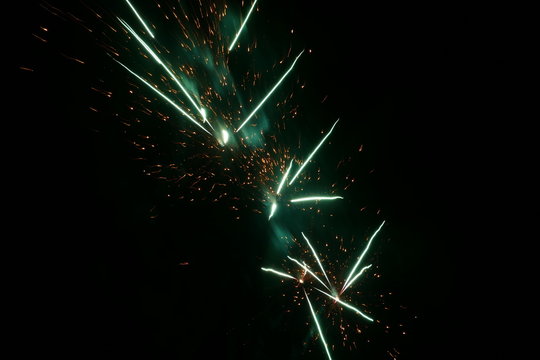
In order to click on light in this screenshot , I will do `click(210, 89)`.